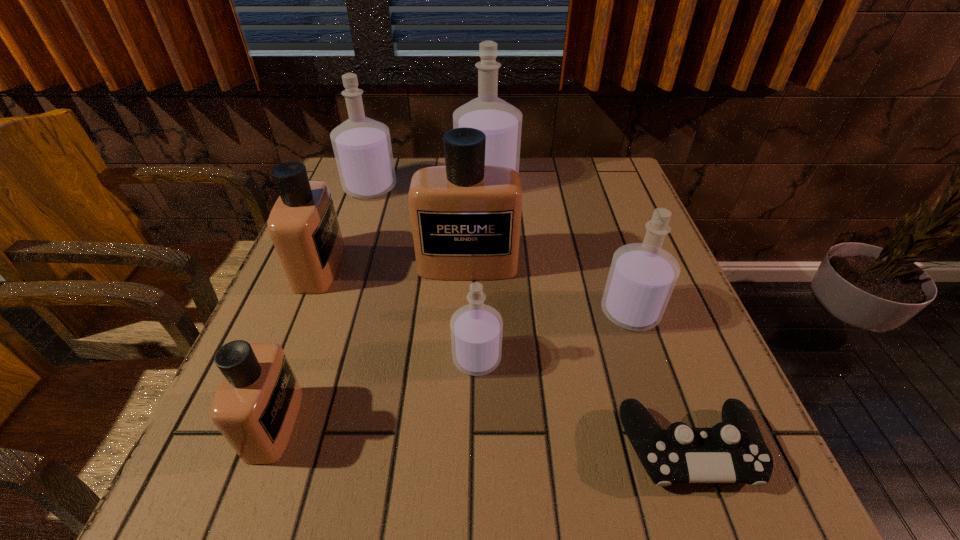
I want to click on the smallest beige perfume, so click(x=255, y=408).

The image size is (960, 540). Find the location of `control`. control is located at coordinates (733, 451).

At what (x,y) coordinates should I click in order to perform the action: click on the shortest object. Please return your answer as a coordinate pair (x, y). Looking at the image, I should click on (733, 451).

Locate an element on the screen. free region located 0.380m on the front of the tallest object is located at coordinates (490, 303).

The image size is (960, 540). What are the coordinates of `vacant region located on the right of the leftmost purple perfume` in the screenshot? It's located at (532, 187).

Find the location of a particular element. The image size is (960, 540). blank space located 0.260m on the front label of the rightmost beige perfume is located at coordinates (464, 387).

This screenshot has width=960, height=540. I want to click on vacant space located on the left of the third farthest purple perfume, so click(x=454, y=312).

Identify the location of vacant space situated 0.080m on the front label of the second smallest beige perfume. (375, 267).

Identify the location of vacant space positioned on the front of the second nearest perfume. (476, 446).

Identify the location of vacant space positioned on the front label of the smallest beige perfume. (391, 424).